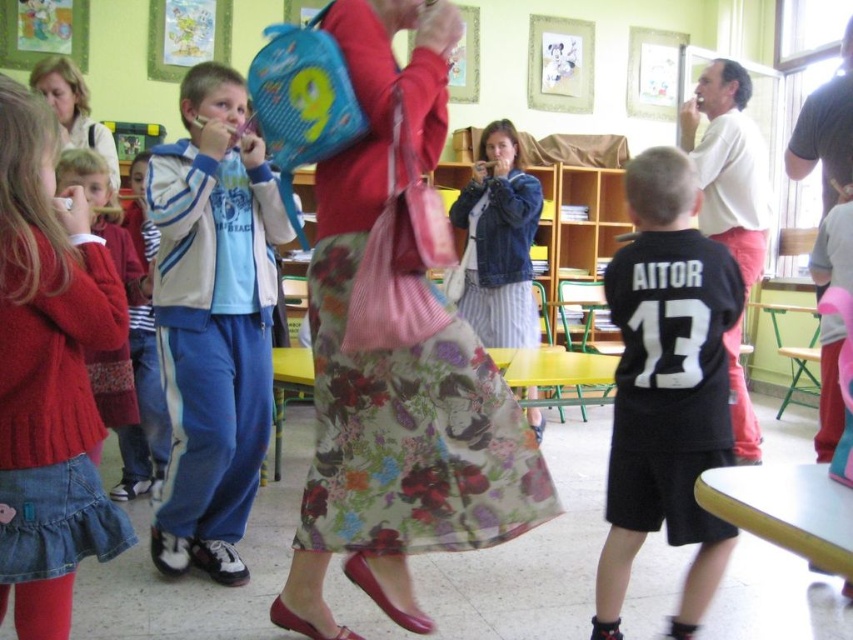
Question: Does floral fabric skirt at center have a smaller size compared to floral fabric dress at center?

Choices:
 (A) no
 (B) yes

Answer: (A)

Question: Based on their relative distances, which object is farther from the floral fabric skirt at center?

Choices:
 (A) blue track suit at left
 (B) knitted red sweater at left

Answer: (A)

Question: Is blue track suit at left thinner than black jersey at center?

Choices:
 (A) yes
 (B) no

Answer: (B)

Question: Which point is closer to the camera?

Choices:
 (A) black jersey at center
 (B) floral fabric skirt at center

Answer: (B)

Question: Can you confirm if floral fabric skirt at center is wider than floral fabric dress at center?

Choices:
 (A) no
 (B) yes

Answer: (B)

Question: Estimate the real-world distances between objects in this image. Which object is closer to the knitted red sweater at left?

Choices:
 (A) blue track suit at left
 (B) floral fabric dress at center
 (C) floral fabric skirt at center
 (D) black jersey at center

Answer: (B)